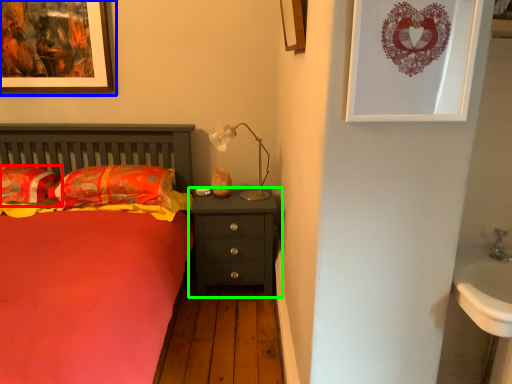
Question: Which is nearer to the pillow (highlighted by a red box)? picture frame (highlighted by a blue box) or nightstand (highlighted by a green box).

Choices:
 (A) picture frame
 (B) nightstand

Answer: (A)